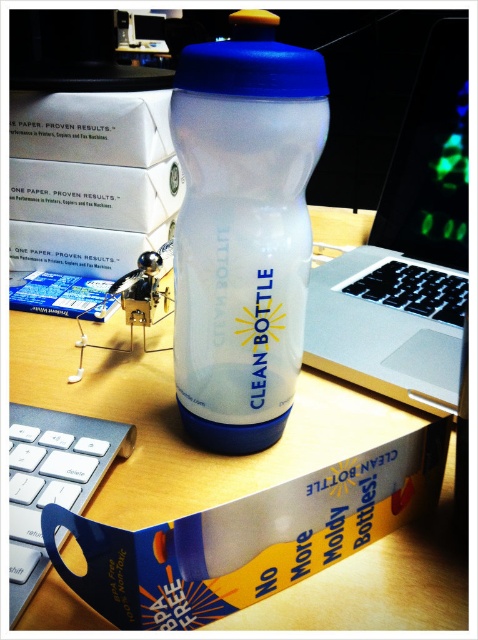
Can you confirm if white matte table at center is positioned to the left of sleek silver laptop at center?

Yes, white matte table at center is to the left of sleek silver laptop at center.

Does white matte table at center appear over sleek silver laptop at center?

Actually, white matte table at center is below sleek silver laptop at center.

Where is `white matte table at center`? The width and height of the screenshot is (478, 640). white matte table at center is located at coordinates (180, 424).

The height and width of the screenshot is (640, 478). In order to click on white matte table at center in this screenshot , I will do `click(180, 424)`.

Between point (271, 435) and point (42, 576), which one is positioned in front?

Point (42, 576) is more forward.

What do you see at coordinates (242, 228) in the screenshot? I see `transparent plastic bottle at center` at bounding box center [242, 228].

Which is in front, point (253, 182) or point (11, 566)?

Point (11, 566) is more forward.

Find the location of `transparent plastic bottle at center`. transparent plastic bottle at center is located at coordinates pos(242,228).

At what (x,y) coordinates should I click in order to perform the action: click on white matte table at center. Please return your answer as a coordinate pair (x, y). The height and width of the screenshot is (640, 478). Looking at the image, I should click on (180, 424).

Who is more distant from viewer, (x=237, y=474) or (x=235, y=195)?

The point (x=237, y=474) is behind.

You are a GUI agent. You are given a task and a screenshot of the screen. Output one action in this format:
    pyautogui.click(x=<x>, y=<y>)
    Task: Click on the white matte table at center
    
    Given the screenshot: What is the action you would take?
    pyautogui.click(x=180, y=424)